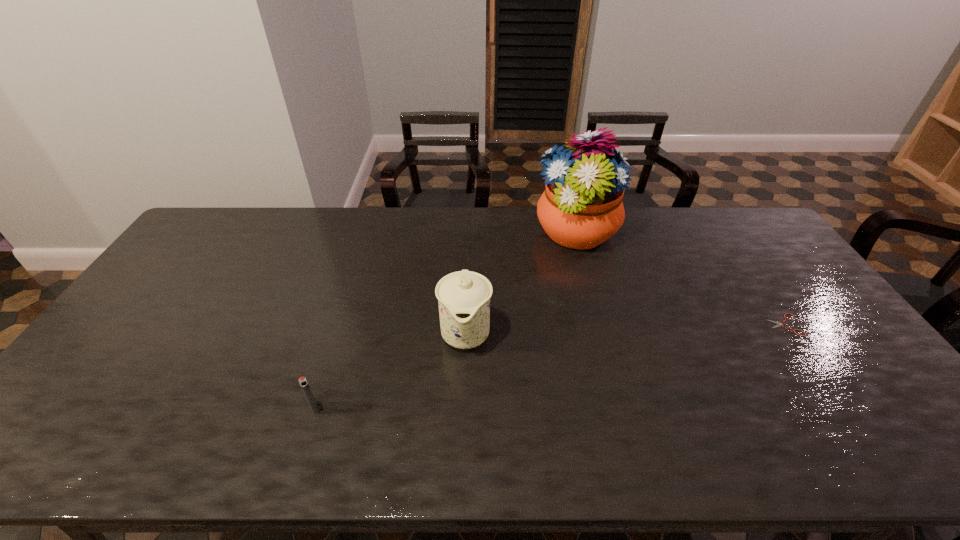
You are a GUI agent. You are given a task and a screenshot of the screen. Output one action in this format:
    pyautogui.click(x=<x>, y=<y>)
    Task: Click on the free space located on the left of the igniter
    
    Given the screenshot: What is the action you would take?
    pyautogui.click(x=180, y=409)

This screenshot has width=960, height=540. I want to click on vacant space located 0.190m on the front of the shears, so click(x=832, y=396).

Locate an element on the screen. object at the far edge is located at coordinates (581, 207).

The image size is (960, 540). I want to click on object that is at the right edge, so click(780, 322).

Locate an element on the screen. Image resolution: width=960 pixels, height=540 pixels. vacant space at the far edge of the desktop is located at coordinates click(423, 221).

In the image, there is a desktop. Where is `free space at the left edge`? free space at the left edge is located at coordinates (109, 398).

This screenshot has width=960, height=540. Identify the location of free space at the right edge. (916, 422).

This screenshot has width=960, height=540. I want to click on vacant point at the far right corner, so click(715, 211).

Locate an element on the screen. vacant area between the tallest object and the third object from right to left is located at coordinates coord(521,283).

At what (x,y) coordinates should I click in order to perform the action: click on vacant space in between the second tallest object and the igniter. Please return your answer as a coordinate pair (x, y). Looking at the image, I should click on (390, 370).